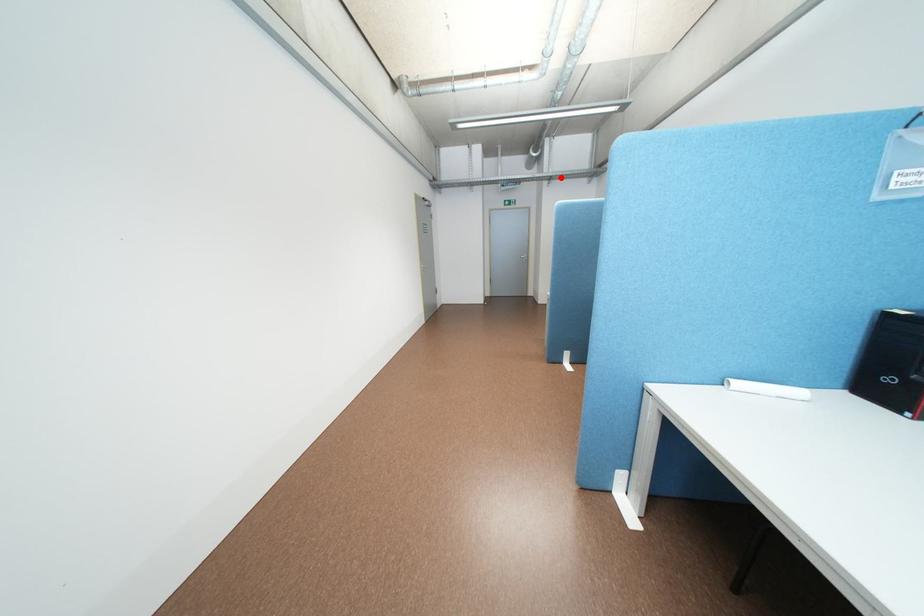
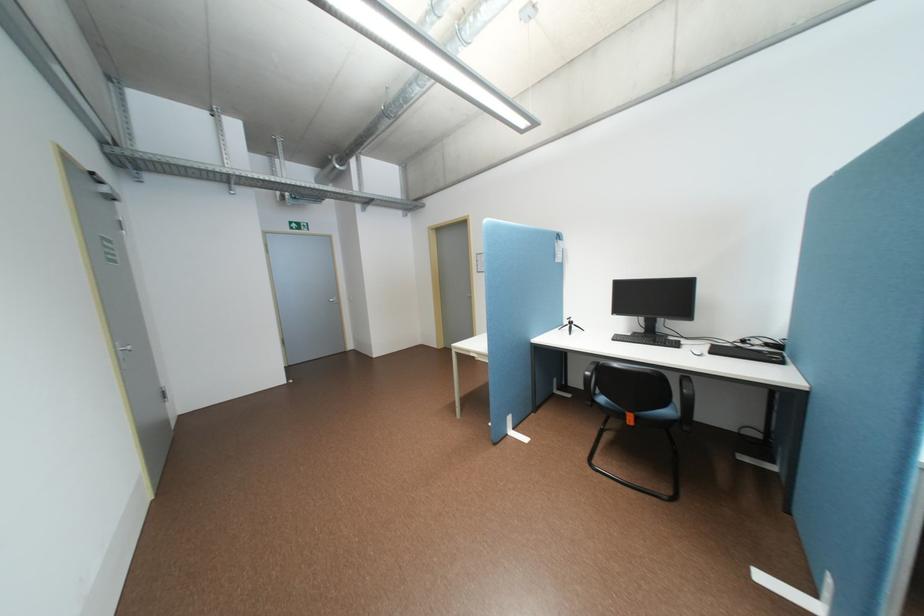
The point at the highlighted location is marked in the first image. Where is the corresponding point in the second image?

(379, 201)